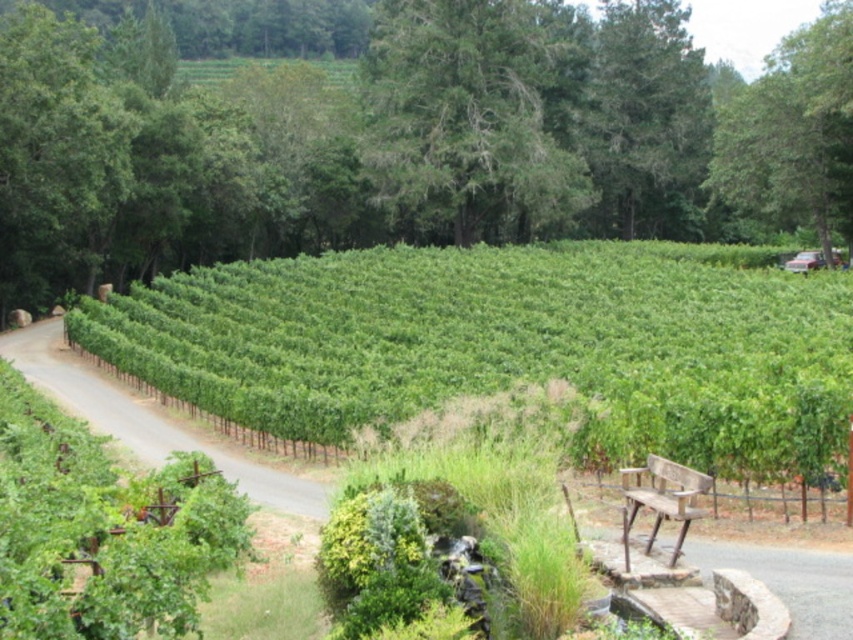
Question: Is green textured tree at center to the left of wooden bench at lower right from the viewer's perspective?

Choices:
 (A) no
 (B) yes

Answer: (A)

Question: Can you confirm if green leafy tree at upper center is smaller than wooden bench at lower right?

Choices:
 (A) yes
 (B) no

Answer: (B)

Question: Which is nearer to the green leafy tree at upper right?

Choices:
 (A) green leafy tree at upper center
 (B) wooden bench at lower right
 (C) green textured tree at center

Answer: (C)

Question: Which is farther from the green leafy hedge at center?

Choices:
 (A) wooden bench at lower right
 (B) green leafy tree at upper center

Answer: (A)

Question: Does green textured tree at center appear over green leafy tree at upper right?

Choices:
 (A) no
 (B) yes

Answer: (B)

Question: Which of the following is the closest to the observer?

Choices:
 (A) (631, 518)
 (B) (460, 224)
 (C) (390, 198)
 (D) (154, 320)

Answer: (A)